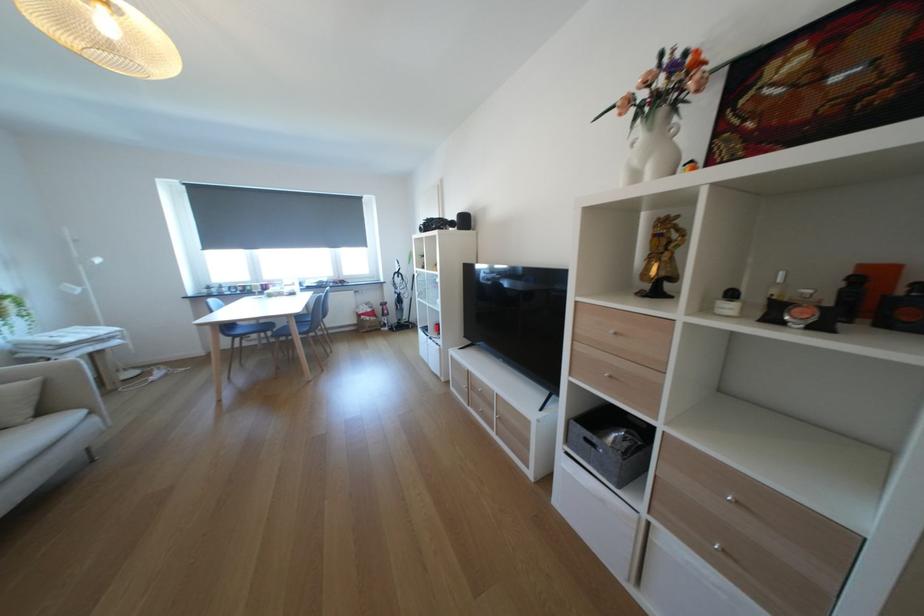
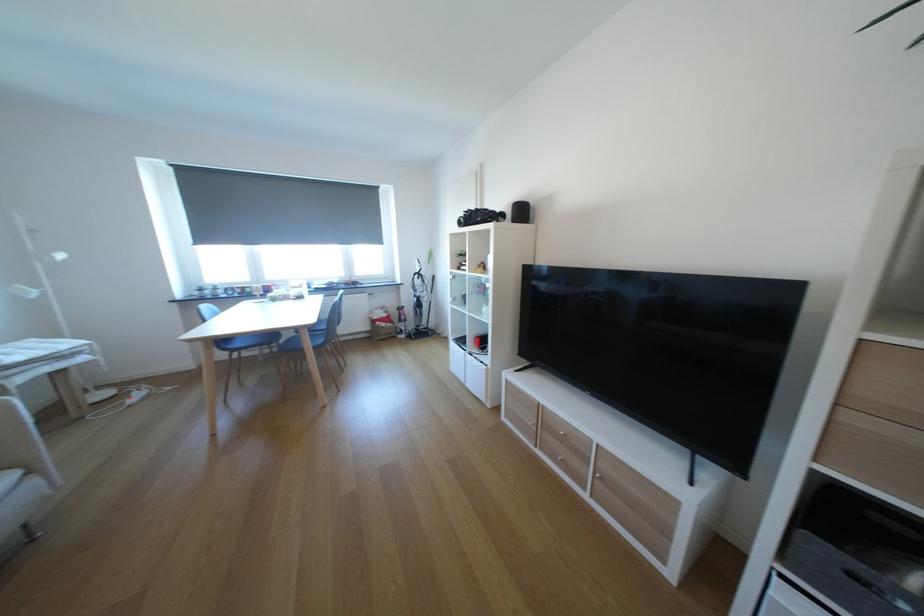
Where in the second image is the point corresponding to [91,286] from the first image?

(47, 286)